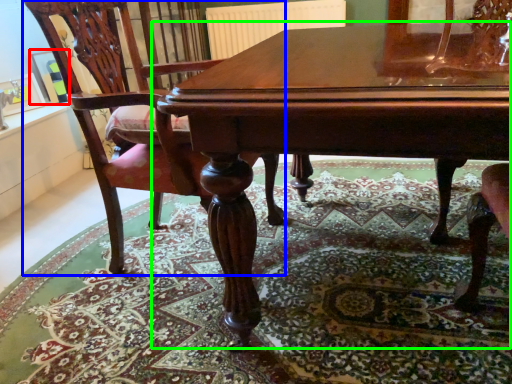
Question: Estimate the real-world distances between objects in this image. Which object is closer to picture frame (highlighted by a red box), chair (highlighted by a blue box) or table (highlighted by a green box)?

Choices:
 (A) chair
 (B) table

Answer: (A)